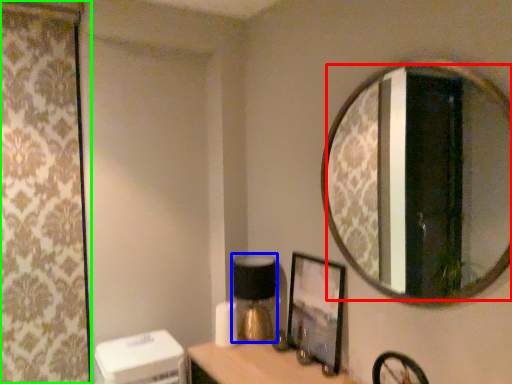
Question: Considering the real-world distances, which object is farthest from mirror (highlighted by a red box)? table lamp (highlighted by a blue box) or curtain (highlighted by a green box)?

Choices:
 (A) table lamp
 (B) curtain

Answer: (B)